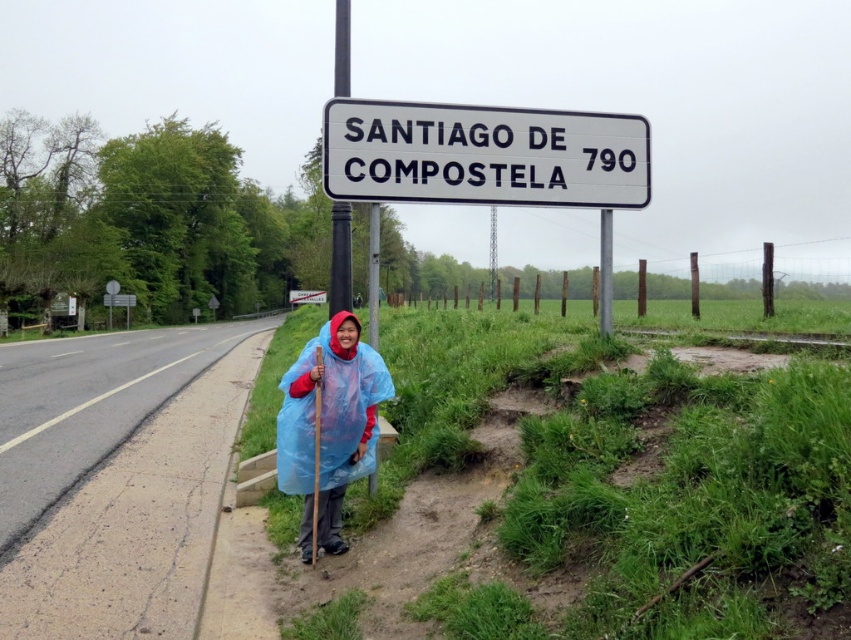
Who is higher up, white plastic sign at center or black metal signpost at upper center?

Positioned higher is black metal signpost at upper center.

Is point (398, 188) closer to viewer compared to point (346, 244)?

Yes, point (398, 188) is closer to viewer.

Which is in front, point (624, 168) or point (343, 74)?

Positioned in front is point (624, 168).

Where is `white plastic sign at center`? The width and height of the screenshot is (851, 640). white plastic sign at center is located at coordinates (483, 154).

Describe the element at coordinates (483, 154) in the screenshot. Image resolution: width=851 pixels, height=640 pixels. I see `white plastic sign at center` at that location.

Does white plastic sign at center come in front of transparent blue poncho at center?

No, it is behind transparent blue poncho at center.

Is point (564, 141) closer to camera compared to point (363, 449)?

No.

Where is `white plastic sign at center`? white plastic sign at center is located at coordinates (483, 154).

Does transparent blue poncho at center appear on the right side of black metal signpost at upper center?

Correct, you'll find transparent blue poncho at center to the right of black metal signpost at upper center.

At what (x,y) coordinates should I click in order to perform the action: click on transparent blue poncho at center. Please return your answer as a coordinate pair (x, y). The image size is (851, 640). Looking at the image, I should click on (329, 426).

Between point (338, 506) and point (346, 93), which one is positioned in front?

Point (338, 506) is in front.

What are the coordinates of `transparent blue poncho at center` in the screenshot? It's located at (329, 426).